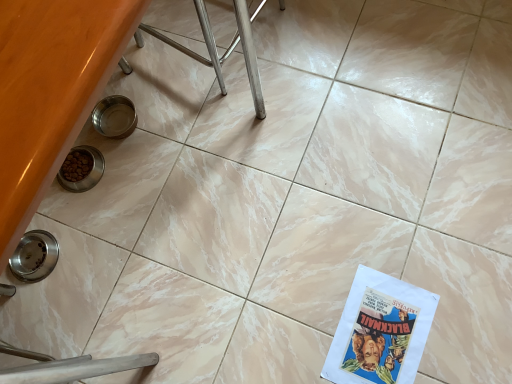
The image size is (512, 384). Identify the location of vacant space to the right of brushed metal stool at upper center. coord(339,38).